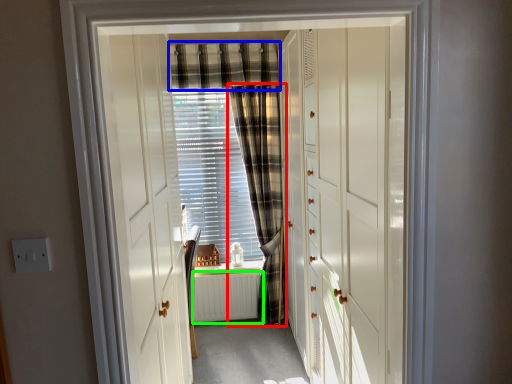
Question: Based on their relative distances, which object is farther from curtain (highlighted by a red box)? Choose from curtain (highlighted by a blue box) and radiator (highlighted by a green box).

Choices:
 (A) curtain
 (B) radiator

Answer: (A)